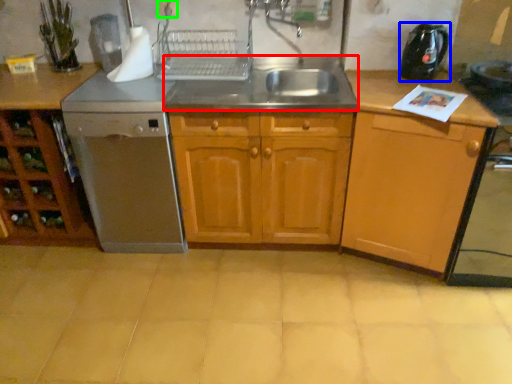
Question: Which is nearer to the sink (highlighted by a red box)? kitchen appliance (highlighted by a blue box) or electric outlet (highlighted by a green box).

Choices:
 (A) kitchen appliance
 (B) electric outlet

Answer: (A)